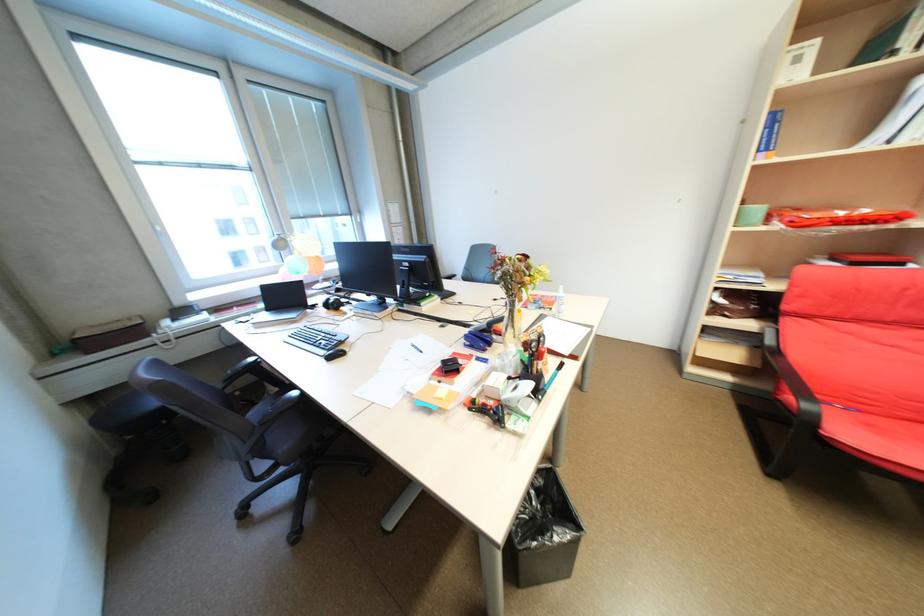
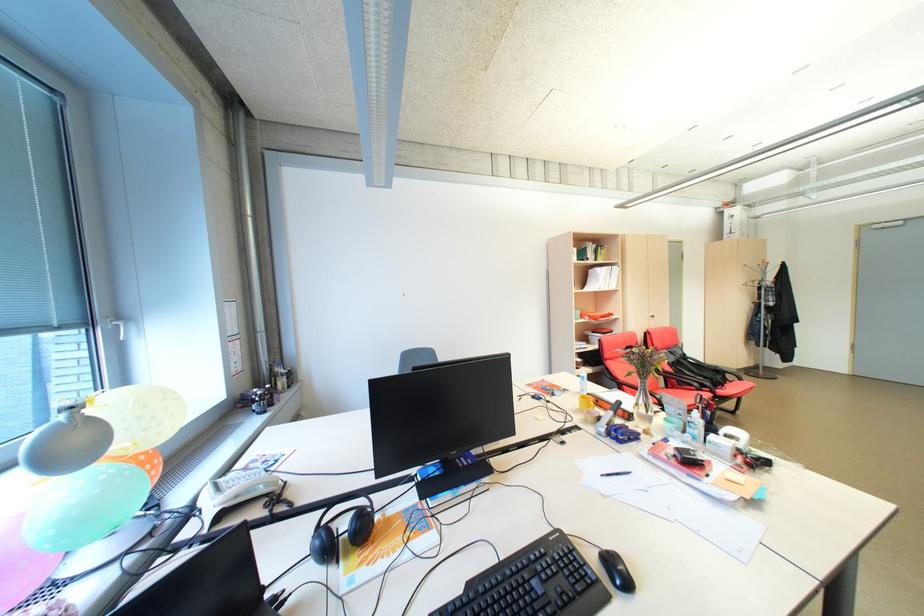
In the second image, find the point that corresponds to point (424, 349) in the first image.

(627, 475)